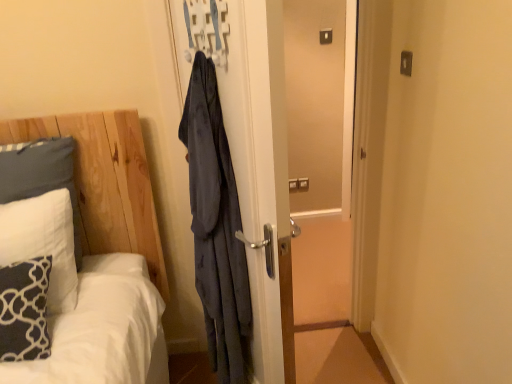
Question: Is white soft pillow at left, positioned as the second pillow in front-to-back order, thinner than white soft pillow at left, which is the third pillow from front to back?

Choices:
 (A) yes
 (B) no

Answer: (B)

Question: From the image's perspective, is white soft pillow at left, positioned as the second pillow in front-to-back order, above white soft pillow at left, which is the third pillow from front to back?

Choices:
 (A) no
 (B) yes

Answer: (A)

Question: Considering the relative sizes of white soft pillow at left, which is the 2th pillow in back-to-front order, and white soft pillow at left, positioned as the 1th pillow in back-to-front order, in the image provided, is white soft pillow at left, which is the 2th pillow in back-to-front order, wider than white soft pillow at left, positioned as the 1th pillow in back-to-front order,?

Choices:
 (A) yes
 (B) no

Answer: (A)

Question: Does white soft pillow at left, positioned as the second pillow in front-to-back order, contain white soft pillow at left, positioned as the 1th pillow in back-to-front order?

Choices:
 (A) no
 (B) yes

Answer: (A)

Question: From the image's perspective, would you say white soft pillow at left, which is the 2th pillow in back-to-front order, is shown under white soft pillow at left, which is the third pillow from front to back?

Choices:
 (A) no
 (B) yes

Answer: (B)

Question: Is white soft pillow at left, which is the 2th pillow in back-to-front order, shorter than white soft pillow at left, which is the third pillow from front to back?

Choices:
 (A) yes
 (B) no

Answer: (A)

Question: From the image's perspective, is white soft pillow at left, positioned as the 1th pillow in back-to-front order, above matte blue fabric hanger at upper center?

Choices:
 (A) no
 (B) yes

Answer: (A)

Question: Is white soft pillow at left, positioned as the 1th pillow in back-to-front order, to the left of matte blue fabric hanger at upper center from the viewer's perspective?

Choices:
 (A) yes
 (B) no

Answer: (A)

Question: Is white soft pillow at left, positioned as the 1th pillow in back-to-front order, closer to camera compared to matte blue fabric hanger at upper center?

Choices:
 (A) yes
 (B) no

Answer: (B)

Question: Is white soft pillow at left, positioned as the 1th pillow in back-to-front order, facing away from matte blue fabric hanger at upper center?

Choices:
 (A) no
 (B) yes

Answer: (A)

Question: Is matte blue fabric hanger at upper center located within white soft pillow at left, which is the third pillow from front to back?

Choices:
 (A) no
 (B) yes

Answer: (A)

Question: From a real-world perspective, is white soft pillow at left, which is the third pillow from front to back, beneath matte blue fabric hanger at upper center?

Choices:
 (A) yes
 (B) no

Answer: (A)

Question: Is white soft pillow at left, which is the third pillow from front to back, positioned with its back to dark blue textured pillow at lower left, which ranks as the 3th pillow in back-to-front order?

Choices:
 (A) no
 (B) yes

Answer: (A)